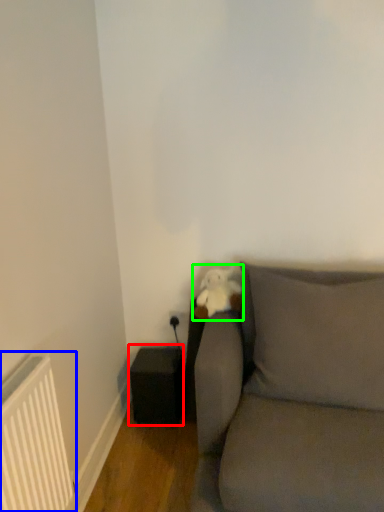
Question: Which is nearer to the speaker (highlighted by a red box)? radiator (highlighted by a blue box) or toy (highlighted by a green box).

Choices:
 (A) radiator
 (B) toy

Answer: (B)